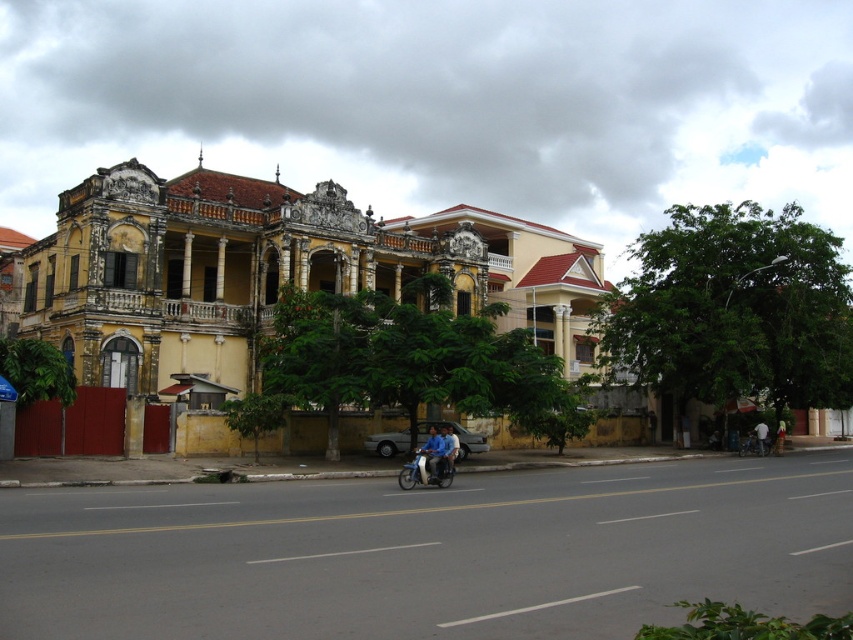
You are a pedestrian standing on the sidewalk in front of the yellow building. You see a blue metallic motorcycle at center and a light blue shirt at center. Which object is closer to the building?

The blue metallic motorcycle at center is closer to the building because it is positioned to the left of the light blue shirt at center, which is further away from the building.

You are standing on the sidewalk in front of the yellow building with ornate architectural details. You see a point at coordinate (x=425, y=472). Which object is this point located on?

The point at coordinate (x=425, y=472) is located on the blue metallic motorcycle at center.